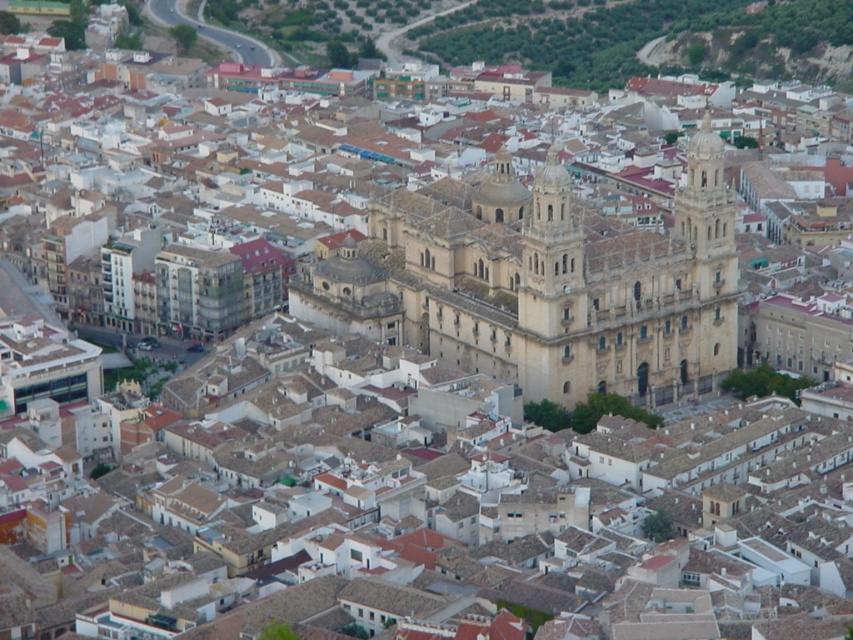
You are a drone operator tasked with capturing aerial footage of the urban area. Your camera is currently positioned at point (553, 294). Based on the scene description, what architectural feature will be directly below your camera? Please respond with the exact object label from the Objects list.

The point (553, 294) corresponds to the light beige stone tower at center.